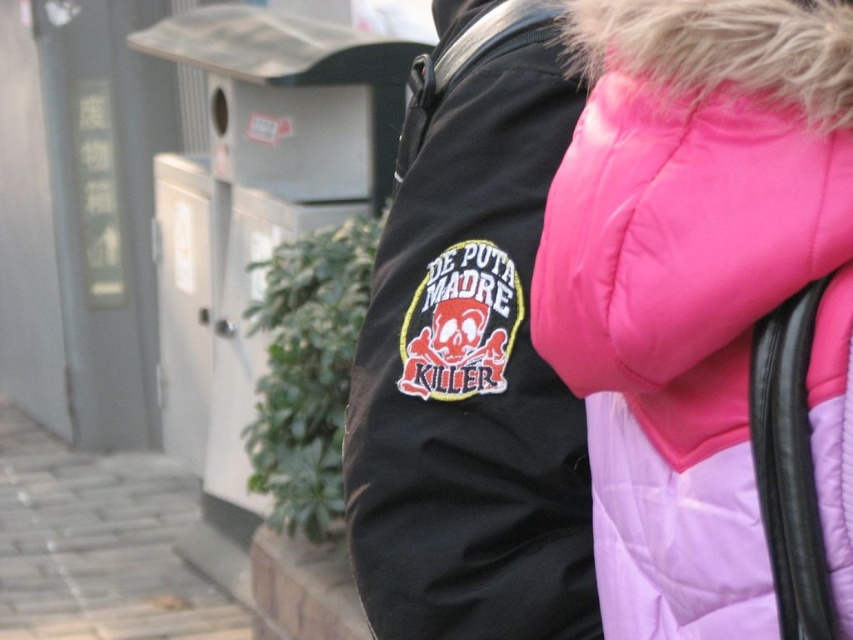
Question: Which object is the farthest from the pink quilted jacket at upper right?

Choices:
 (A) gray brick pavement at lower left
 (B) black matte jacket at center

Answer: (A)

Question: Which point is closer to the camera?

Choices:
 (A) (196, 628)
 (B) (519, 496)
 (C) (781, 420)

Answer: (C)

Question: Which object is the closest to the pink quilted jacket at upper right?

Choices:
 (A) black matte jacket at center
 (B) gray brick pavement at lower left

Answer: (A)

Question: Can you confirm if pink quilted jacket at upper right is positioned above black matte jacket at center?

Choices:
 (A) yes
 (B) no

Answer: (B)

Question: Is black matte jacket at center in front of gray brick pavement at lower left?

Choices:
 (A) no
 (B) yes

Answer: (B)

Question: Does pink quilted jacket at upper right appear over black matte jacket at center?

Choices:
 (A) no
 (B) yes

Answer: (A)